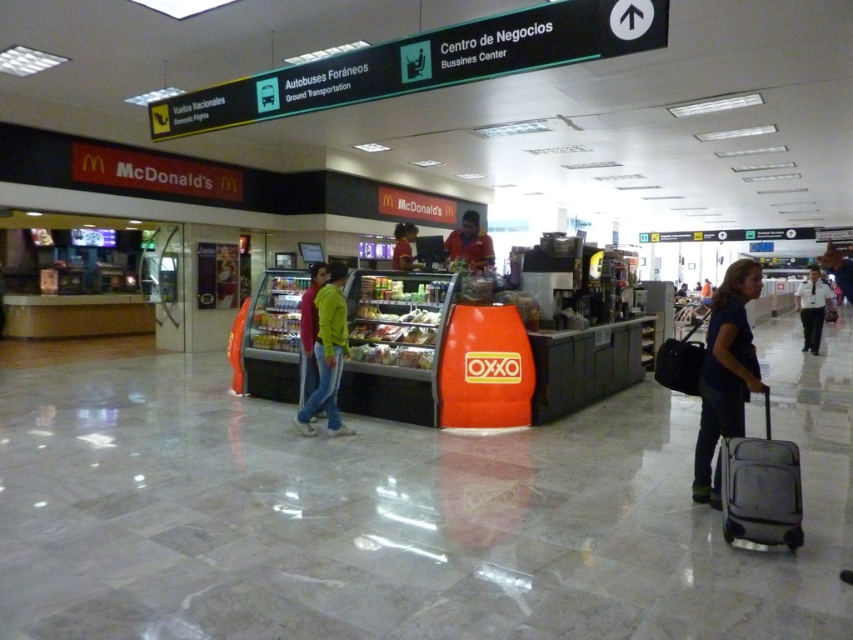
You are an airport employee tasked with arranging name tags for two passengers. The passengers are wearing a matte black shirt at center and a matte yellow shirt at center. Since the name tags must be proportional to their clothing size, which shirt should get the bigger name tag?

The matte black shirt at center is larger in size than the matte yellow shirt at center, so the bigger name tag should be given to the matte black shirt at center.